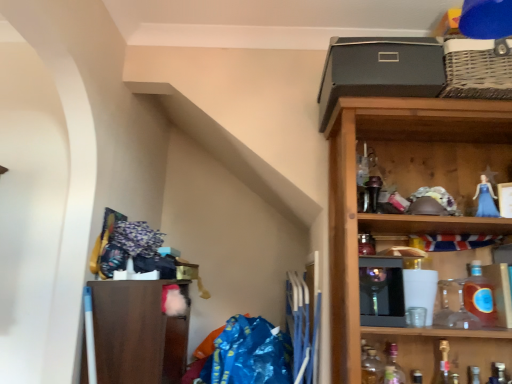
Question: Looking at their shapes, would you say translucent glass bottle at lower right, which appears as the 1th bottle when viewed from the left, is wider or thinner than translucent amber glass bottle at right, positioned as the 2th bottle in right-to-left order?

Choices:
 (A) thin
 (B) wide

Answer: (A)

Question: Would you say translucent glass bottle at lower right, which appears as the 1th bottle when viewed from the left, is inside or outside translucent amber glass bottle at right, the 4th bottle from the left?

Choices:
 (A) outside
 (B) inside

Answer: (A)

Question: Estimate the real-world distances between objects in this image. Which object is closer to the gold metallic bottle at lower right, the third bottle positioned from the right?

Choices:
 (A) translucent amber glass bottle at right, the 4th bottle from the left
 (B) matte gray box at upper right
 (C) wooden shelf at upper right, which is the 1th shelf from right to left
 (D) translucent glass bottle at lower right, which is counted as the fifth bottle, starting from the right
 (E) brown matte cabinet at lower left, the 1th shelf viewed from the left

Answer: (A)

Question: Which of these objects is positioned farthest from the translucent glass bottle at lower right, the second bottle viewed from the left?

Choices:
 (A) metallic silver bottle at lower right, the 1th bottle viewed from the right
 (B) translucent amber glass bottle at right, positioned as the 2th bottle in right-to-left order
 (C) matte gray box at upper right
 (D) blue plastic bag at lower center
 (E) gold metallic bottle at lower right, the third bottle positioned from the right

Answer: (C)